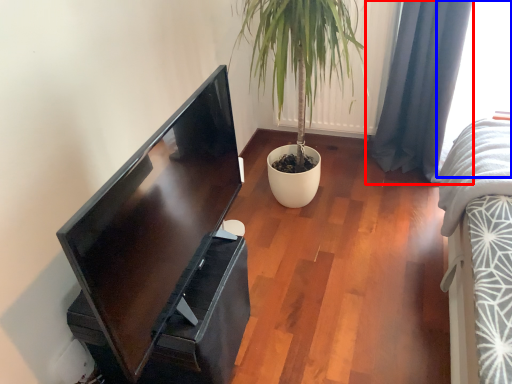
Question: Which object appears closest to the camera in this image, curtain (highlighted by a red box) or window (highlighted by a blue box)?

Choices:
 (A) curtain
 (B) window

Answer: (B)